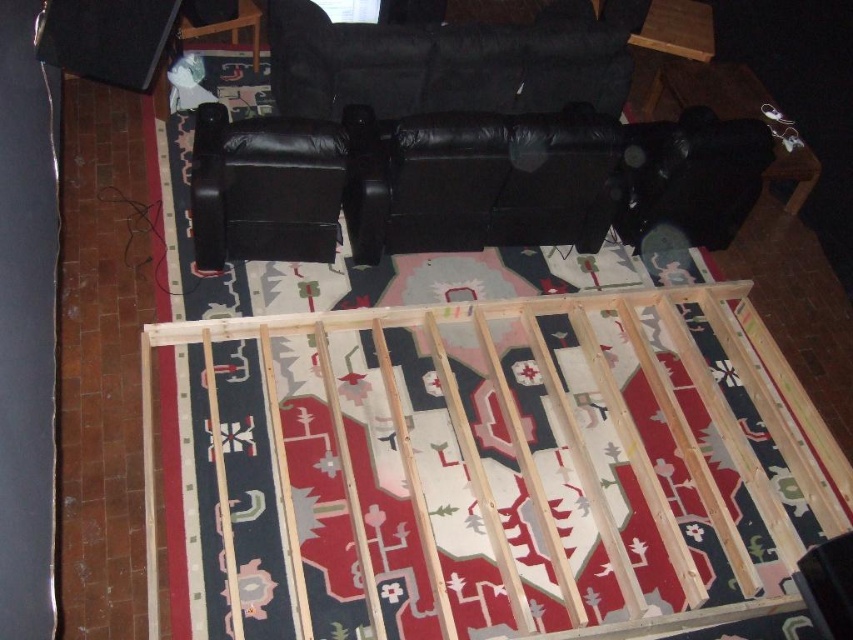
You are standing in the room and want to determine which of the two points, point (595,84) or point (761,106), is closer to you. Based on the scene description, which point is nearer?

Point (595,84) is closer to the viewer than point (761,106).

You are arranging furniture in a room. You have a black leather couch at center and a black leather armchair at upper center. Which piece of furniture is located to the right of the other?

The black leather couch at center is positioned on the right side of the black leather armchair at upper center.

You are standing in the room and want to determine which of the two points, point (489, 45) or point (267, 138), is closer to you. Based on the scene description, which point is nearer?

Point (489, 45) is further to the viewer than point (267, 138). Therefore, point (267, 138) is closer to you.